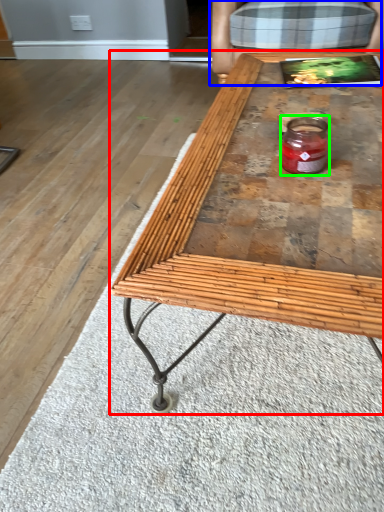
Question: Which object is positioned farthest from coffee table (highlighted by a red box)? Select from armchair (highlighted by a blue box) and glass jar (highlighted by a green box).

Choices:
 (A) armchair
 (B) glass jar

Answer: (A)